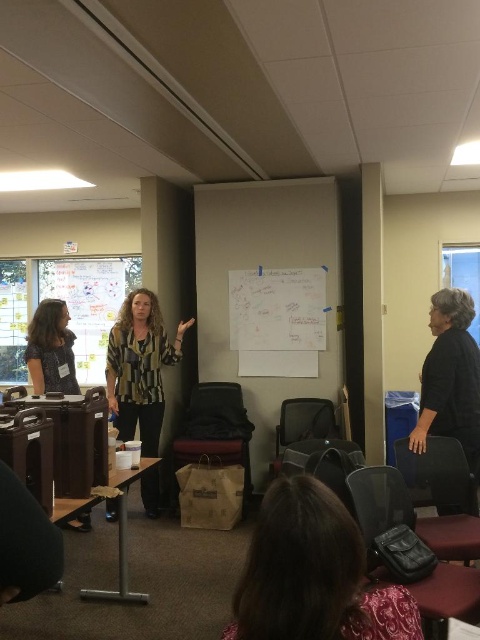
You are standing at the point with coordinates point [32,362]. You want to walk to the whiteboard. There is an obstacle at point [339,524]. Will you be able to walk around it?

Point [339,524] is in front of point [32,362]. Therefore, you are behind the obstacle and cannot walk around it without moving past the obstacle first.

You are organizing a workshop and need to place a name tag on the table where the dark brown leather bag at lower center and the matte black shirt at left are located. Which object should you place the name tag closer to if you want it to be near the smaller item?

The dark brown leather bag at lower center occupies less space than the matte black shirt at left, so you should place the name tag closer to the dark brown leather bag at lower center.

You are an observer in the room. You notice two people wearing different shirts. The striped fabric blouse at center and the matte black shirt at left. Which shirt do you think is bigger?

The striped fabric blouse at center is larger in size than the matte black shirt at left.